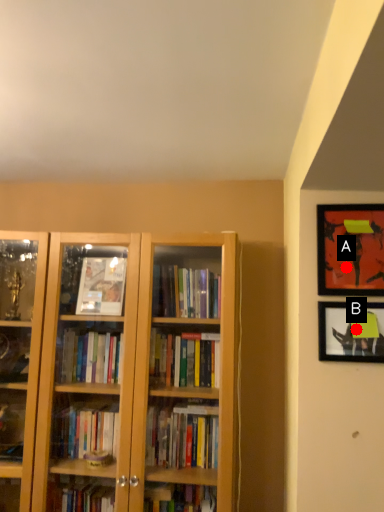
Question: Two points are circled on the image, labeled by A and B beside each circle. Which point is farther to the camera?

Choices:
 (A) A is further
 (B) B is further

Answer: (A)